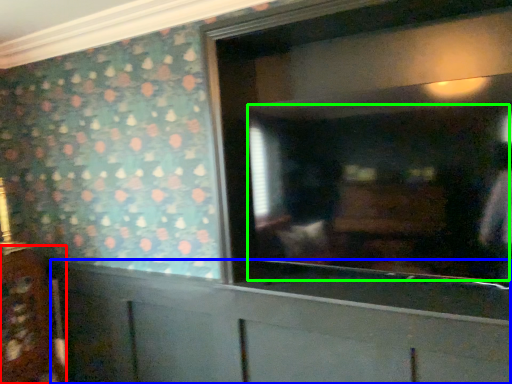
Question: Which object is the farthest from cabinetry (highlighted by a red box)? Choose among these: cabinetry (highlighted by a blue box) or mirror (highlighted by a green box).

Choices:
 (A) cabinetry
 (B) mirror

Answer: (B)